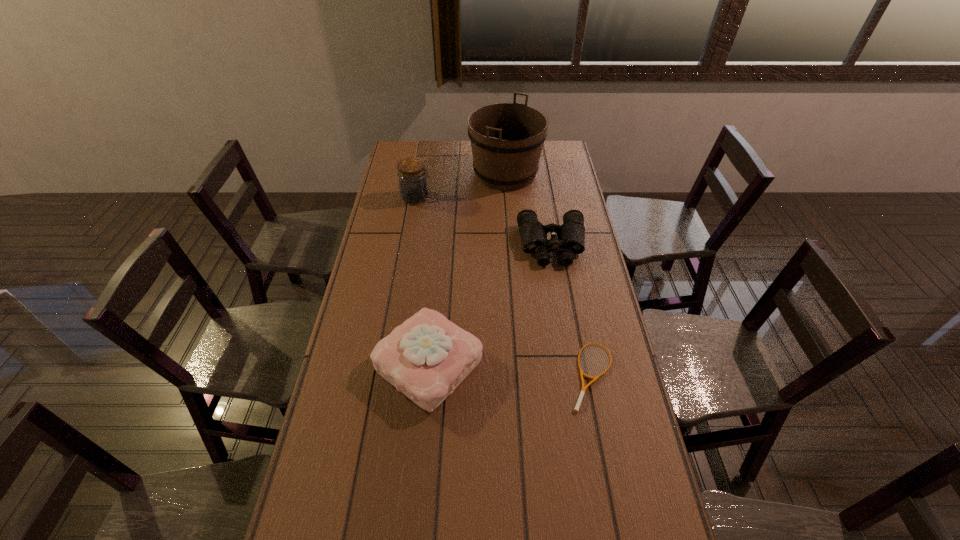
Find the location of a particular element. free space located on the left of the shortest object is located at coordinates (438, 375).

Where is `object at the far edge`? object at the far edge is located at coordinates (507, 139).

The width and height of the screenshot is (960, 540). Identify the location of jar situated at the left edge. (413, 187).

The width and height of the screenshot is (960, 540). What are the coordinates of `cake that is positioned at the left edge` in the screenshot? It's located at (426, 357).

Identify the location of bucket present at the right edge. The width and height of the screenshot is (960, 540). pyautogui.click(x=507, y=139).

Locate an element on the screen. This screenshot has height=540, width=960. binoculars at the right edge is located at coordinates (570, 239).

The height and width of the screenshot is (540, 960). What are the coordinates of `tennis racket at the right edge` in the screenshot? It's located at (576, 409).

In order to click on object situated at the far right corner in this screenshot , I will do `click(507, 139)`.

You are a GUI agent. You are given a task and a screenshot of the screen. Output one action in this format:
    pyautogui.click(x=<x>, y=<y>)
    Task: Click on the vacant position at the left edge of the desktop
    Image resolution: width=960 pixels, height=540 pixels.
    Given the screenshot: What is the action you would take?
    pyautogui.click(x=366, y=376)

In the image, there is a desktop. At what (x,y) coordinates should I click in order to perform the action: click on vacant space at the right edge. Please return your answer as a coordinate pair (x, y). This screenshot has height=540, width=960. Looking at the image, I should click on (620, 517).